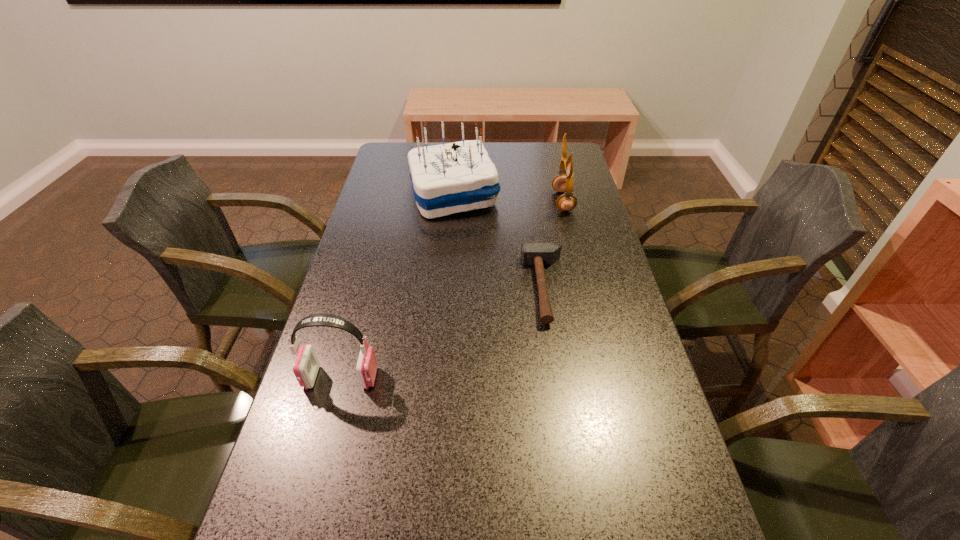
Identify the location of object present at the far left corner. Image resolution: width=960 pixels, height=540 pixels. (456, 177).

Where is `blank space at the far edge of the desktop`? The image size is (960, 540). blank space at the far edge of the desktop is located at coordinates (513, 165).

Find the location of a particular element. free space at the left edge of the desktop is located at coordinates (355, 254).

Identify the location of free space at the right edge. (603, 291).

Find the location of a particular element. The width and height of the screenshot is (960, 540). free region at the far left corner is located at coordinates (396, 166).

Identify the location of free spot at the far right corner of the desktop. (556, 167).

At what (x,y) coordinates should I click in order to perform the action: click on free space between the birthday cake and the nearest object. Please return your answer as a coordinate pair (x, y). The width and height of the screenshot is (960, 540). Looking at the image, I should click on (397, 286).

The width and height of the screenshot is (960, 540). What are the coordinates of `vacant area that lies between the nearest object and the right earphone` in the screenshot? It's located at (452, 289).

The height and width of the screenshot is (540, 960). Find the location of `free space that is in between the left earphone and the rightmost object`. free space that is in between the left earphone and the rightmost object is located at coordinates (452, 289).

Where is `unoccupied position between the left earphone and the farther earphone`? This screenshot has width=960, height=540. unoccupied position between the left earphone and the farther earphone is located at coordinates (452, 289).